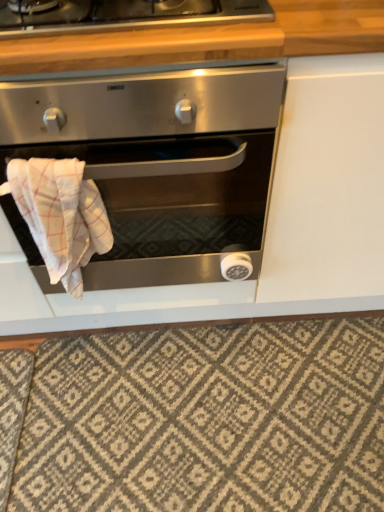
Question: Is the depth of satin silver oven at center greater than that of patterned carpet at lower center?

Choices:
 (A) yes
 (B) no

Answer: (B)

Question: Is satin silver oven at center far away from patterned carpet at lower center?

Choices:
 (A) no
 (B) yes

Answer: (A)

Question: Considering the relative positions of satin silver oven at center and patterned carpet at lower center in the image provided, is satin silver oven at center in front of patterned carpet at lower center?

Choices:
 (A) yes
 (B) no

Answer: (A)

Question: Is satin silver oven at center shorter than patterned carpet at lower center?

Choices:
 (A) no
 (B) yes

Answer: (A)

Question: Considering the relative positions of satin silver oven at center and patterned carpet at lower center in the image provided, is satin silver oven at center to the left of patterned carpet at lower center from the viewer's perspective?

Choices:
 (A) yes
 (B) no

Answer: (A)

Question: Considering the relative sizes of satin silver oven at center and patterned carpet at lower center in the image provided, is satin silver oven at center taller than patterned carpet at lower center?

Choices:
 (A) no
 (B) yes

Answer: (B)

Question: From a real-world perspective, is wooden at upper center positioned under white checkered cloth at lower left based on gravity?

Choices:
 (A) no
 (B) yes

Answer: (A)

Question: Is wooden at upper center surrounding white checkered cloth at lower left?

Choices:
 (A) yes
 (B) no

Answer: (B)

Question: Is wooden at upper center to the left of white checkered cloth at lower left from the viewer's perspective?

Choices:
 (A) no
 (B) yes

Answer: (A)

Question: Can you see wooden at upper center touching white checkered cloth at lower left?

Choices:
 (A) yes
 (B) no

Answer: (B)

Question: From the image's perspective, is wooden at upper center over white checkered cloth at lower left?

Choices:
 (A) no
 (B) yes

Answer: (B)

Question: Is wooden at upper center outside of white checkered cloth at lower left?

Choices:
 (A) yes
 (B) no

Answer: (A)

Question: Is wooden at upper center touching patterned carpet at lower center?

Choices:
 (A) yes
 (B) no

Answer: (B)